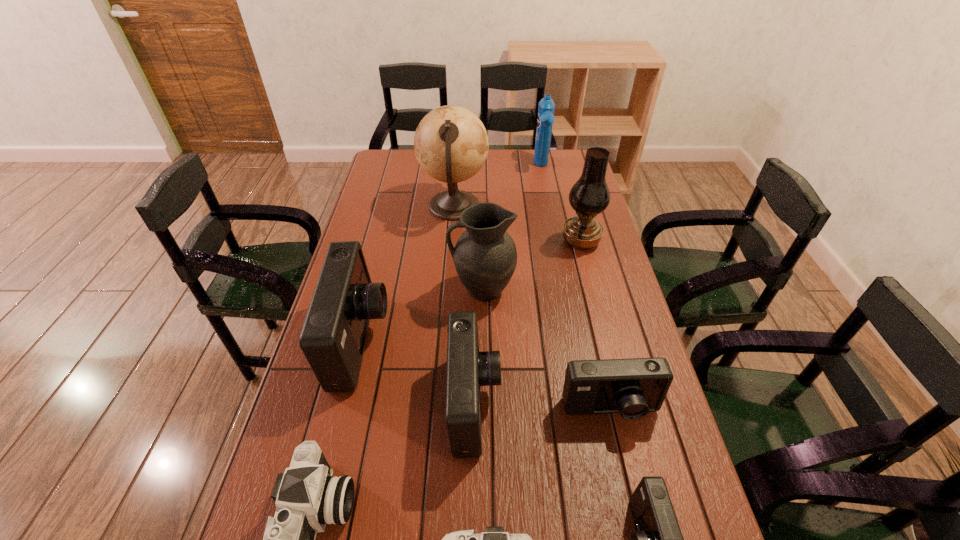
Locate an element on the screen. The image size is (960, 540). globe is located at coordinates (451, 144).

Find the location of a particular element. oil lamp is located at coordinates (589, 196).

In order to click on the farthest object in this screenshot , I will do tap(545, 119).

I want to click on pitcher, so click(x=485, y=257).

I want to click on the sixth shortest object, so [x=333, y=336].

Locate an element on the screen. The image size is (960, 540). the biggest blue camera is located at coordinates (333, 336).

What are the coordinates of `the second blue camera from left to right` in the screenshot? It's located at (467, 369).

Identify the location of the fifth shortest object. This screenshot has height=540, width=960. (467, 369).

I want to click on the second smallest blue camera, so click(633, 387).

Where is `vacant space situated 0.130m on the front-facing side of the globe`? This screenshot has width=960, height=540. vacant space situated 0.130m on the front-facing side of the globe is located at coordinates (521, 207).